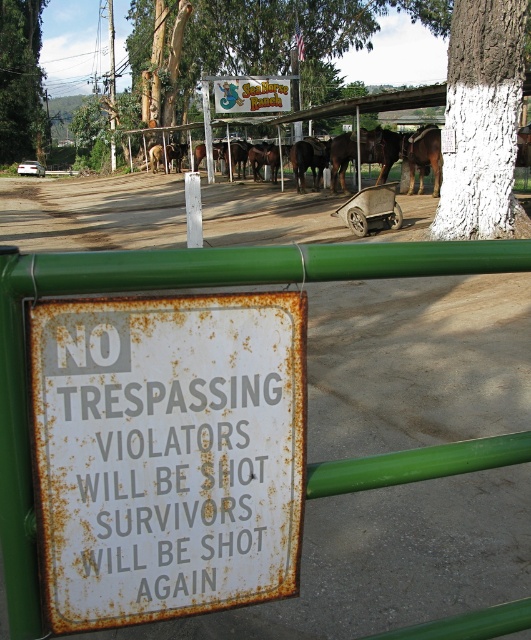
You are a delivery driver approaching a property with a fence. You see a rusty metal sign at center and a white painted bark at upper center. Which object is larger in size?

The white painted bark at upper center is larger than the rusty metal sign at center.